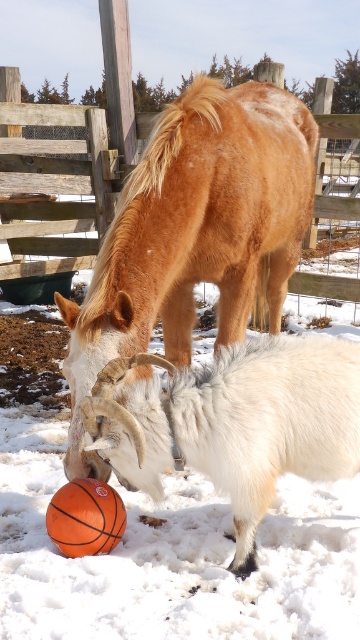
Question: Among these objects, which one is farthest from the camera?

Choices:
 (A) brown fuzzy horse at center
 (B) wooden fence at upper center

Answer: (B)

Question: Does brown fuzzy horse at center appear on the left side of wooden fence at upper center?

Choices:
 (A) yes
 (B) no

Answer: (B)

Question: Which of the following is the closest to the observer?

Choices:
 (A) orange rubber basketball at lower center
 (B) white woolen goat at lower center
 (C) wooden fence at upper center
 (D) brown fuzzy horse at center

Answer: (B)

Question: From the image, what is the correct spatial relationship of brown fuzzy horse at center in relation to orange rubber basketball at lower center?

Choices:
 (A) above
 (B) below

Answer: (A)

Question: Can you confirm if wooden fence at upper center is wider than orange rubber basketball at lower center?

Choices:
 (A) yes
 (B) no

Answer: (A)

Question: Among these points, which one is farthest from the camera?

Choices:
 (A) (106, 524)
 (B) (259, 218)

Answer: (B)